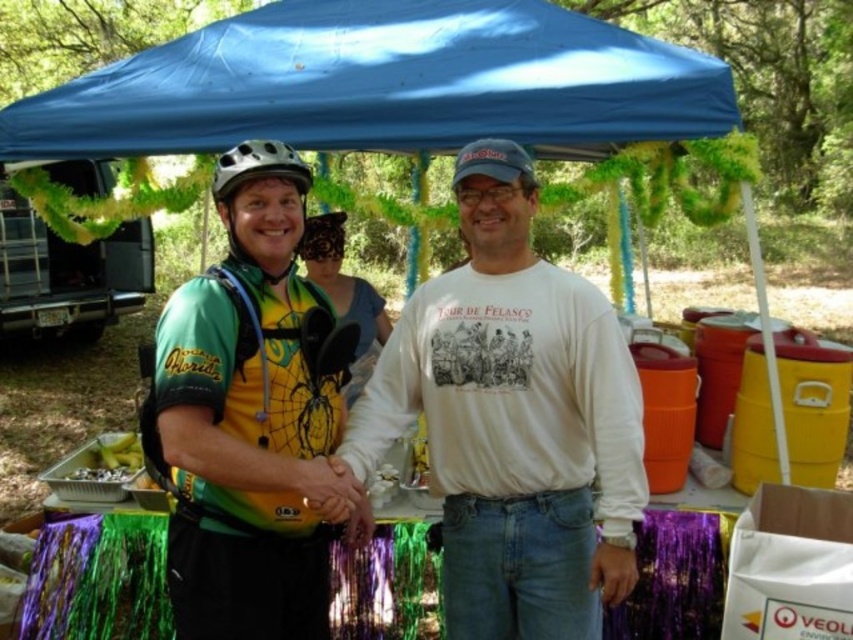
Is blue fabric canopy at upper center positioned in front of white matte bicycle helmet at upper left?

No, it is not.

Looking at this image, can you confirm if blue fabric canopy at upper center is positioned above white matte bicycle helmet at upper left?

Yes, blue fabric canopy at upper center is above white matte bicycle helmet at upper left.

Between point (614, 70) and point (300, 188), which one is positioned behind?

The point (614, 70) is behind.

At what (x,y) coordinates should I click in order to perform the action: click on blue fabric canopy at upper center. Please return your answer as a coordinate pair (x, y). Image resolution: width=853 pixels, height=640 pixels. Looking at the image, I should click on (383, 84).

Who is lower down, matte black helmet at center or white matte bicycle helmet at upper left?

matte black helmet at center is below.

Can you confirm if matte black helmet at center is wider than white matte bicycle helmet at upper left?

In fact, matte black helmet at center might be narrower than white matte bicycle helmet at upper left.

Identify the location of matte black helmet at center. (254, 176).

Between blue fabric canopy at upper center and patterned fabric headscarf at center, which one appears on the right side from the viewer's perspective?

blue fabric canopy at upper center

Between point (415, 13) and point (314, 244), which one is positioned in front?

Point (415, 13)

The image size is (853, 640). What do you see at coordinates (383, 84) in the screenshot?
I see `blue fabric canopy at upper center` at bounding box center [383, 84].

At what (x,y) coordinates should I click in order to perform the action: click on blue fabric canopy at upper center. Please return your answer as a coordinate pair (x, y). This screenshot has height=640, width=853. Looking at the image, I should click on (383, 84).